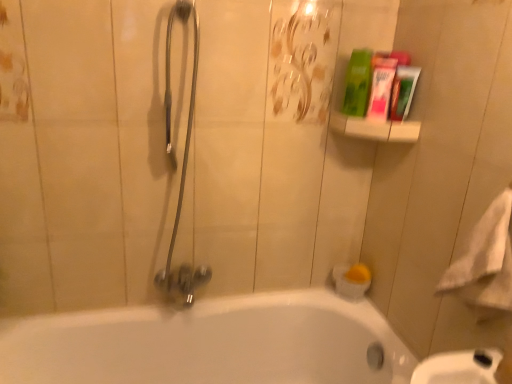
Question: Is satin silver shower head at center left wider or thinner than green matte box at upper right?

Choices:
 (A) wide
 (B) thin

Answer: (A)

Question: Do you think satin silver shower head at center left is within green matte box at upper right, or outside of it?

Choices:
 (A) inside
 (B) outside

Answer: (B)

Question: Considering the real-world distances, which object is farthest from the green plastic container at upper right?

Choices:
 (A) white soft towel at right
 (B) green matte tube at upper right, marked as the 1th mouthwash in a right-to-left arrangement
 (C) green matte tube at upper right, the 1th mouthwash when ordered from left to right
 (D) satin silver shower head at center left
 (E) green matte box at upper right

Answer: (D)

Question: Considering the real-world distances, which object is farthest from the green matte tube at upper right, the 1th mouthwash when ordered from left to right?

Choices:
 (A) green matte tube at upper right, which is the 2th mouthwash from left to right
 (B) white soft towel at right
 (C) green plastic container at upper right
 (D) white glossy bathtub at lower center
 (E) green matte box at upper right

Answer: (D)